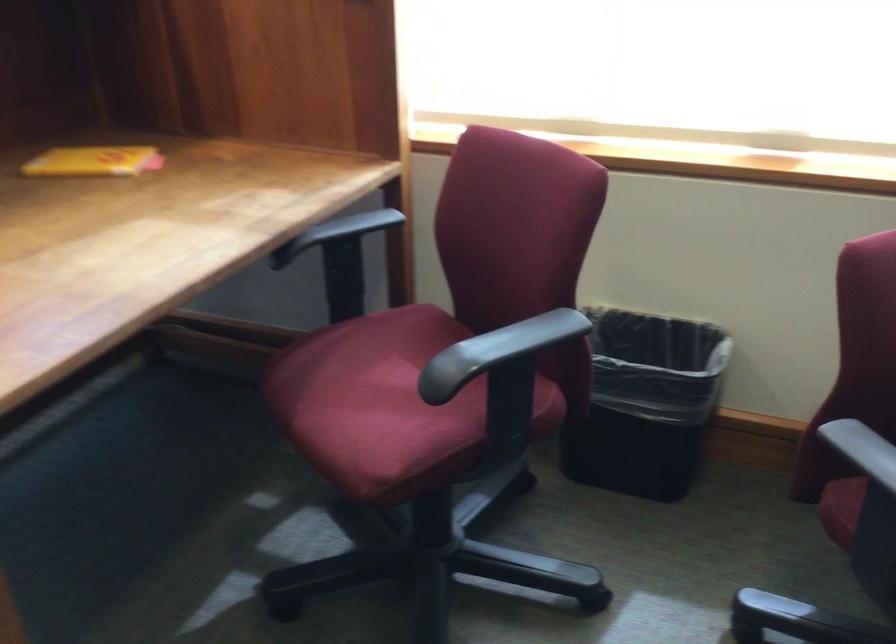
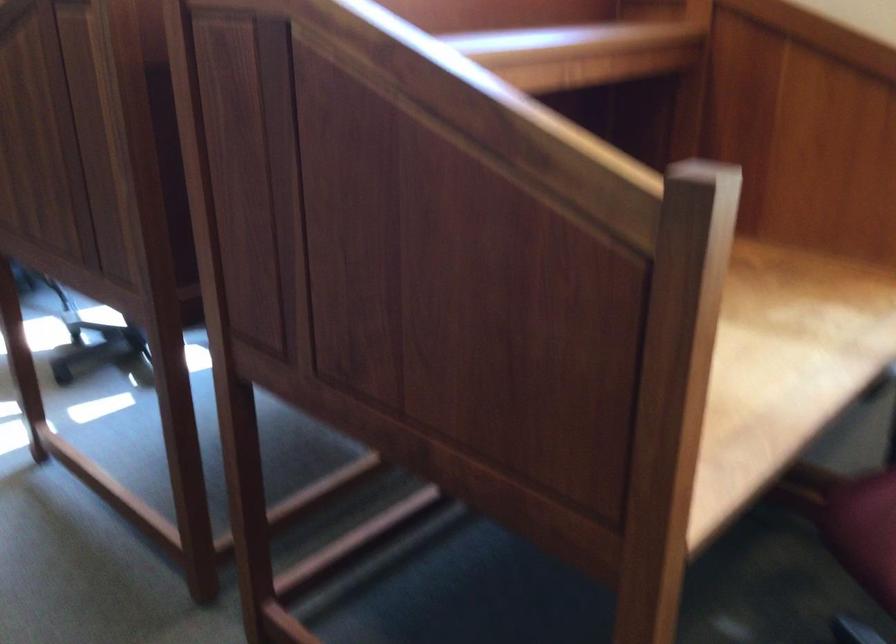
Find the pixel in the second image that matches (178,245) in the first image.

(778, 360)